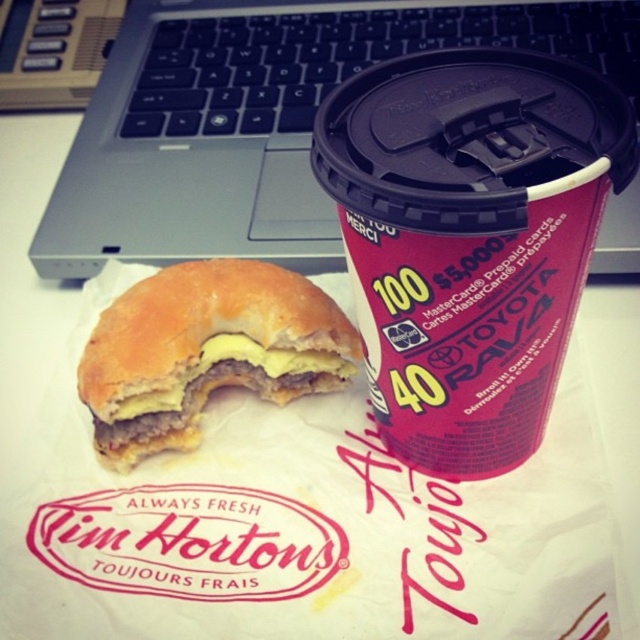
Question: Estimate the real-world distances between objects in this image. Which object is farther from the pink paper cup at upper center?

Choices:
 (A) silver metallic laptop at upper center
 (B) golden-brown breaded patty at center

Answer: (A)

Question: Is pink paper cup at upper center bigger than golden-brown breaded patty at center?

Choices:
 (A) yes
 (B) no

Answer: (A)

Question: Based on their relative distances, which object is nearer to the pink paper cup at upper center?

Choices:
 (A) silver metallic laptop at upper center
 (B) golden-brown breaded patty at center

Answer: (B)

Question: Can you confirm if pink paper cup at upper center is bigger than silver metallic laptop at upper center?

Choices:
 (A) no
 (B) yes

Answer: (A)

Question: Is silver metallic laptop at upper center in front of golden-brown breaded patty at center?

Choices:
 (A) yes
 (B) no

Answer: (B)

Question: Based on their relative distances, which object is farther from the golden-brown breaded patty at center?

Choices:
 (A) pink paper cup at upper center
 (B) silver metallic laptop at upper center

Answer: (B)